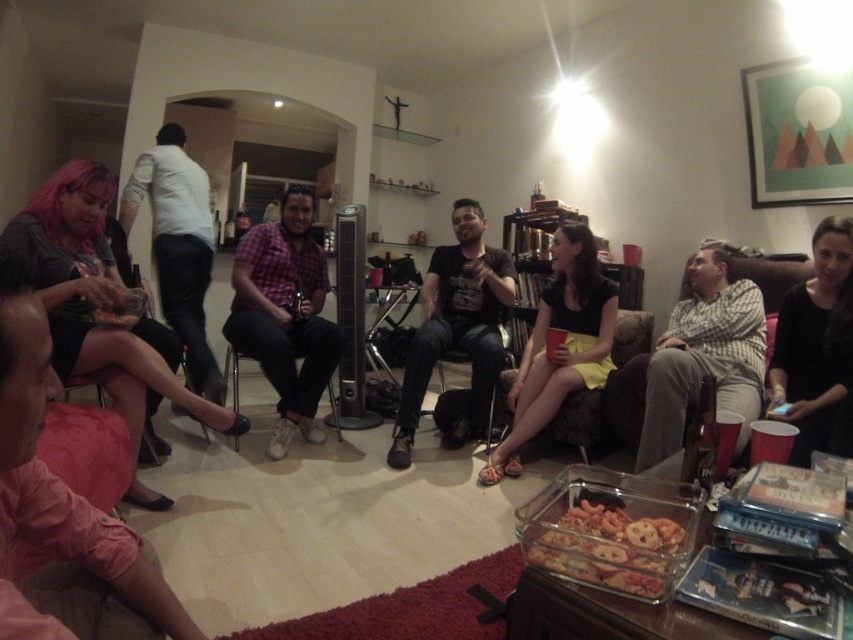
Question: In this image, where is yellow fabric skirt at center located relative to black matte dress at lower right?

Choices:
 (A) below
 (B) above

Answer: (A)

Question: Where is matte black dress at lower left located in relation to striped cotton shirt at center in the image?

Choices:
 (A) above
 (B) below

Answer: (A)

Question: Which of these objects is positioned closest to the striped cotton shirt at center?

Choices:
 (A) pink fabric skirt at lower left
 (B) black cotton shirt at center
 (C) translucent glass dish at lower center

Answer: (B)

Question: Is striped cotton shirt at center to the left of translucent glass dish at lower center from the viewer's perspective?

Choices:
 (A) no
 (B) yes

Answer: (A)

Question: Based on their relative distances, which object is farther from the translucent glass dish at lower center?

Choices:
 (A) matte black dress at lower left
 (B) black matte dress at lower right
 (C) black cotton shirt at center

Answer: (C)

Question: Which object is the farthest from the yellow fabric skirt at center?

Choices:
 (A) translucent glass dish at lower center
 (B) striped cotton shirt at center
 (C) black matte dress at lower right
 (D) pink fabric skirt at lower left

Answer: (D)